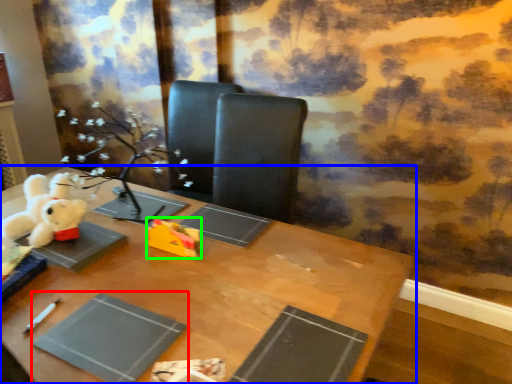
Question: Estimate the real-world distances between objects in this image. Which object is closer to paperback book (highlighted by a red box), table (highlighted by a blue box) or toy (highlighted by a green box)?

Choices:
 (A) table
 (B) toy

Answer: (A)